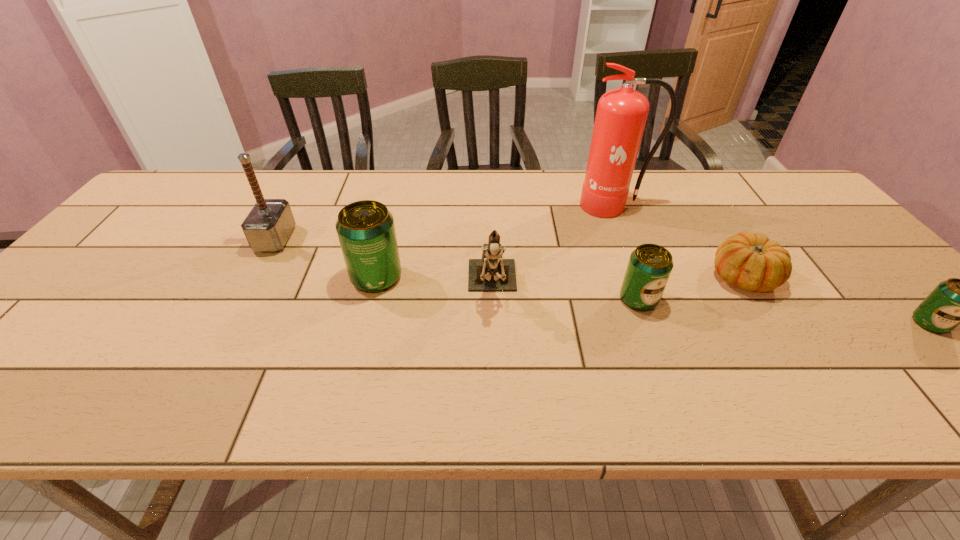
Where is `blank area in the image that satisfies the following two spatial constraints: 1. towards the nozzle of the second object from right to left; 2. on the left side of the farthest object`? The height and width of the screenshot is (540, 960). blank area in the image that satisfies the following two spatial constraints: 1. towards the nozzle of the second object from right to left; 2. on the left side of the farthest object is located at coordinates (642, 277).

Find the location of `free space in the image that satisfies the following two spatial constraints: 1. on the front side of the shortest beer can; 2. on the left side of the fifth tallest object`. free space in the image that satisfies the following two spatial constraints: 1. on the front side of the shortest beer can; 2. on the left side of the fifth tallest object is located at coordinates (647, 323).